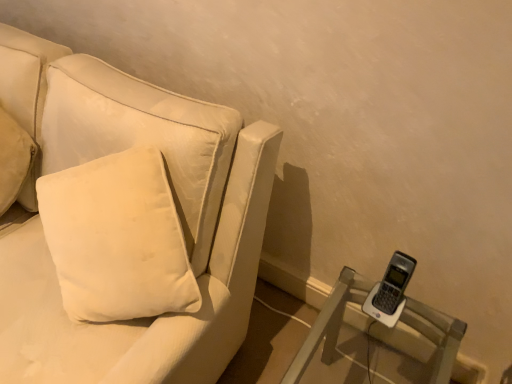
What are the coordinates of `clear plastic phone at lower right` in the screenshot? It's located at 330,322.

Locate an element on the screen. This screenshot has height=384, width=512. velvet white couch at left is located at coordinates (176, 206).

Find the location of a particular element. The height and width of the screenshot is (384, 512). clear plastic phone at lower right is located at coordinates (330, 322).

Is velvet white couch at left to the left or to the right of white soft cushion at left in the image?

In the image, velvet white couch at left appears on the left side of white soft cushion at left.

Considering the positions of objects velvet white couch at left and white soft cushion at left in the image provided, who is behind, velvet white couch at left or white soft cushion at left?

white soft cushion at left.

Is velvet white couch at left turned away from white soft cushion at left?

Yes.

How far apart are velvet white couch at left and white soft cushion at left?

velvet white couch at left is 27.87 centimeters from white soft cushion at left.

From the image's perspective, is clear plastic phone at lower right above or below white soft cushion at left?

clear plastic phone at lower right is situated lower than white soft cushion at left in the image.

In the image, is clear plastic phone at lower right positioned in front of or behind white soft cushion at left?

Visually, clear plastic phone at lower right is located in front of white soft cushion at left.

Based on their positions, is clear plastic phone at lower right located to the left or right of velvet white couch at left?

In the image, clear plastic phone at lower right appears on the right side of velvet white couch at left.

Is the surface of clear plastic phone at lower right in direct contact with velvet white couch at left?

They are not placed beside each other.

Considering the positions of objects clear plastic phone at lower right and velvet white couch at left in the image provided, who is behind, clear plastic phone at lower right or velvet white couch at left?

Positioned behind is clear plastic phone at lower right.

In terms of size, does white soft cushion at left appear bigger or smaller than clear plastic phone at lower right?

white soft cushion at left is smaller than clear plastic phone at lower right.

Which of these two, white soft cushion at left or clear plastic phone at lower right, stands taller?

white soft cushion at left is taller.

Between white soft cushion at left and clear plastic phone at lower right, which one appears on the right side from the viewer's perspective?

Positioned to the right is clear plastic phone at lower right.

Looking at this image, are white soft cushion at left and velvet white couch at left beside each other?

white soft cushion at left and velvet white couch at left are clearly separated.

Considering the sizes of objects white soft cushion at left and velvet white couch at left in the image provided, who is thinner, white soft cushion at left or velvet white couch at left?

white soft cushion at left.

Is white soft cushion at left aimed at velvet white couch at left?

Yes, white soft cushion at left is facing velvet white couch at left.

Can you confirm if white soft cushion at left is positioned to the right of velvet white couch at left?

Yes, white soft cushion at left is to the right of velvet white couch at left.

Considering the points (234, 144) and (451, 348), which point is in front, point (234, 144) or point (451, 348)?

The point (234, 144) is closer to the camera.

Is velvet white couch at left to the left or to the right of clear plastic phone at lower right in the image?

From the image, it's evident that velvet white couch at left is to the left of clear plastic phone at lower right.

Is velvet white couch at left next to clear plastic phone at lower right?

velvet white couch at left and clear plastic phone at lower right are not in contact.

You are a GUI agent. You are given a task and a screenshot of the screen. Output one action in this format:
    pyautogui.click(x=<x>, y=<y>)
    Task: Click on the pillow located behind the velvet white couch at left
    
    Given the screenshot: What is the action you would take?
    point(26,91)

Locate an element on the screen. furniture below the white soft cushion at left (from the image's perspective) is located at coordinates (330, 322).

From the image, which object appears to be farther from white soft cushion at left, velvet white couch at left or clear plastic phone at lower right?

Among the two, clear plastic phone at lower right is located further to white soft cushion at left.

Which object lies nearer to the anchor point white soft cushion at left, clear plastic phone at lower right or velvet white couch at left?

Based on the image, velvet white couch at left appears to be nearer to white soft cushion at left.

Based on the photo, estimate the real-world distances between objects in this image. Which object is further from velvet white couch at left, white soft cushion at left or clear plastic phone at lower right?

clear plastic phone at lower right lies further to velvet white couch at left than the other object.

Considering their positions, is white soft cushion at left positioned further to clear plastic phone at lower right than velvet white couch at left?

white soft cushion at left.

Considering their positions, is velvet white couch at left positioned further to clear plastic phone at lower right than white soft cushion at left?

white soft cushion at left.

Looking at this image, from the image, which object appears to be farther from velvet white couch at left, clear plastic phone at lower right or white soft cushion at left?

clear plastic phone at lower right.

This screenshot has width=512, height=384. Find the location of `pillow between velvet white couch at left and clear plastic phone at lower right in the horizontal direction`. pillow between velvet white couch at left and clear plastic phone at lower right in the horizontal direction is located at coordinates (26, 91).